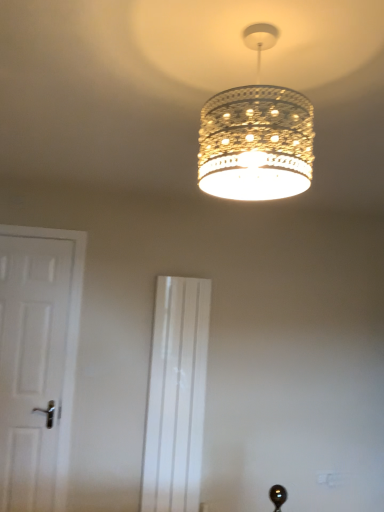
Question: Relative to white glossy screen door at center, is clear glass chandelier at upper center in front or behind?

Choices:
 (A) behind
 (B) front

Answer: (B)

Question: From the image's perspective, is clear glass chandelier at upper center positioned above or below white glossy screen door at center?

Choices:
 (A) below
 (B) above

Answer: (B)

Question: Estimate the real-world distances between objects in this image. Which object is farther from the white glossy screen door at center?

Choices:
 (A) clear glass chandelier at upper center
 (B) white matte door at left

Answer: (A)

Question: Estimate the real-world distances between objects in this image. Which object is closer to the clear glass chandelier at upper center?

Choices:
 (A) white matte door at left
 (B) white glossy screen door at center

Answer: (B)